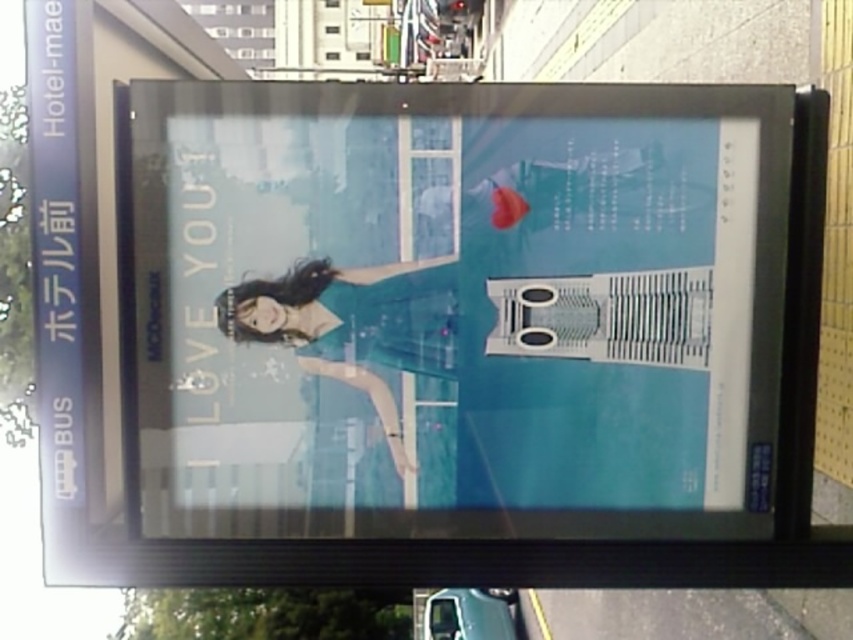
Question: Can you confirm if matte blue poster at center is positioned to the right of matte teal dress at center?

Choices:
 (A) no
 (B) yes

Answer: (B)

Question: Which point is closer to the camera?

Choices:
 (A) matte teal dress at center
 (B) matte blue poster at center

Answer: (B)

Question: Is matte blue poster at center smaller than matte teal dress at center?

Choices:
 (A) no
 (B) yes

Answer: (A)

Question: Which object is farther from the camera taking this photo?

Choices:
 (A) matte teal dress at center
 (B) matte blue poster at center

Answer: (A)

Question: Which point is farther from the camera taking this photo?

Choices:
 (A) (432, 93)
 (B) (392, 292)

Answer: (B)

Question: Can you confirm if matte blue poster at center is positioned above matte teal dress at center?

Choices:
 (A) yes
 (B) no

Answer: (A)